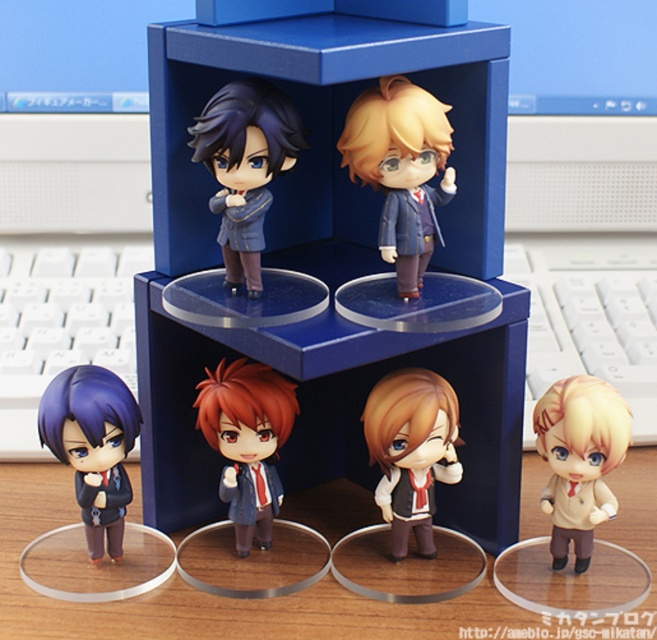
Is white plastic keyboard at upper center to the left of matte blue uniform at upper left from the viewer's perspective?

No, white plastic keyboard at upper center is not to the left of matte blue uniform at upper left.

Who is lower down, white plastic keyboard at upper center or matte blue uniform at upper left?

white plastic keyboard at upper center

Is point (646, 324) behind point (238, 216)?

Yes.

The width and height of the screenshot is (657, 640). I want to click on white plastic keyboard at upper center, so click(585, 252).

Is matte blue uniform at upper left bigger than light brown matte figure at lower right?

Correct, matte blue uniform at upper left is larger in size than light brown matte figure at lower right.

Can you confirm if matte blue uniform at upper left is positioned to the right of light brown matte figure at lower right?

No, matte blue uniform at upper left is not to the right of light brown matte figure at lower right.

Is point (227, 109) in front of point (622, 426)?

Yes, point (227, 109) is closer to viewer.

Where is `matte blue uniform at upper left`? matte blue uniform at upper left is located at coordinates (244, 168).

Can you confirm if matte blue suit at upper center is positioned to the right of light brown matte figure at lower right?

Incorrect, matte blue suit at upper center is not on the right side of light brown matte figure at lower right.

Who is shorter, matte blue suit at upper center or light brown matte figure at lower right?

With less height is light brown matte figure at lower right.

Find the location of a particular element. matte blue suit at upper center is located at coordinates (401, 170).

The image size is (657, 640). I want to click on matte blue suit at upper center, so click(401, 170).